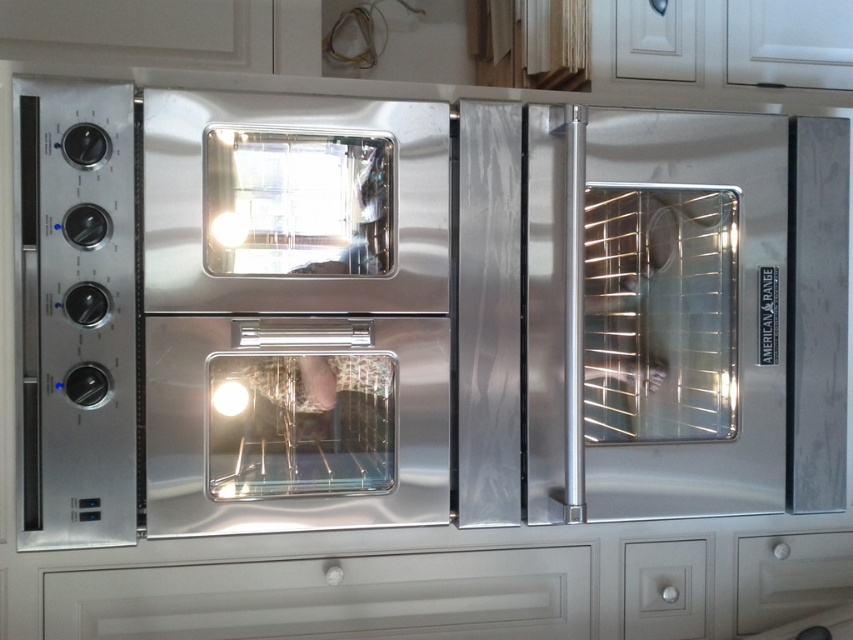
You are standing in the kitchen and need to reach the matte white drawer at lower right. The stainless steel oven at center is blocking your path. Can you move around it to the right side to access the drawer?

Yes, since the stainless steel oven at center is to the left of the matte white drawer at lower right, you can move around the oven to its right side and access the drawer easily.

You are standing in the kitchen and want to reach the point marked as point [395,403]. If your arm can extend 1.2 meters, can you reach it?

The distance between point [395,403] and the camera is 1.38 meters. Since your arm can only extend 1.2 meters, you cannot reach point [395,403].